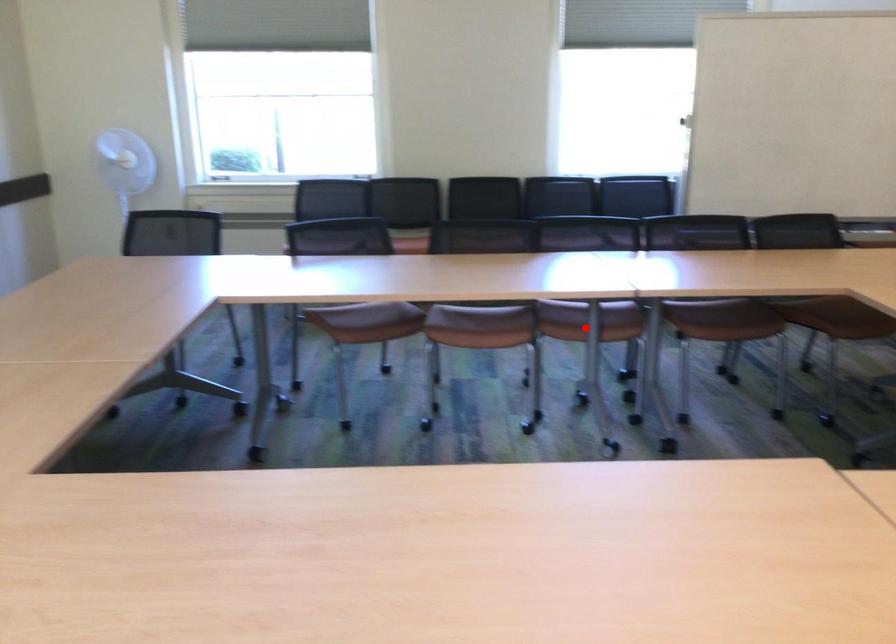
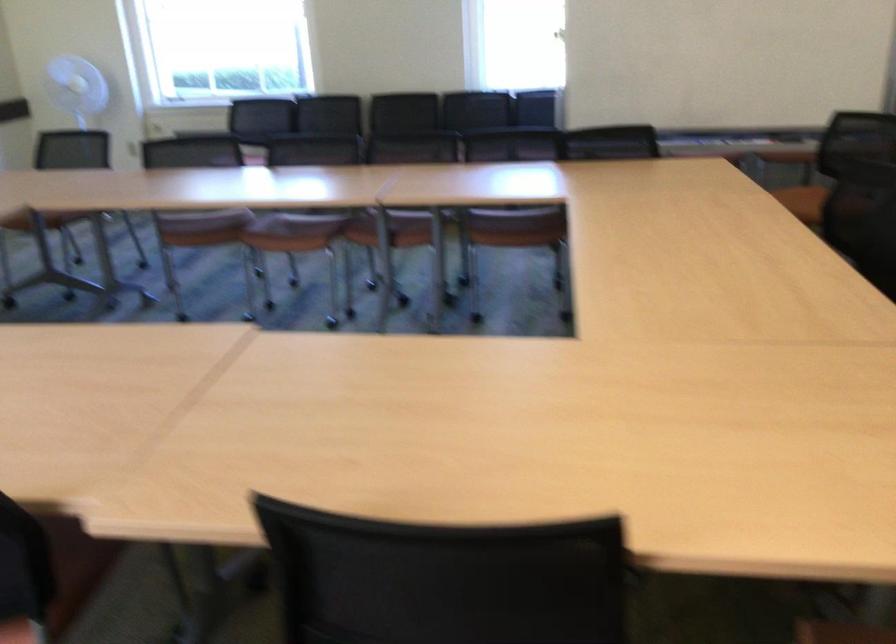
Question: I am providing you with two images of the same scene from different viewpoints. Image1 has a red point marked. In image2, the corresponding 3D location appears at what relative position? Reply with the corresponding letter.

Choices:
 (A) Closer
 (B) Farther

Answer: (B)